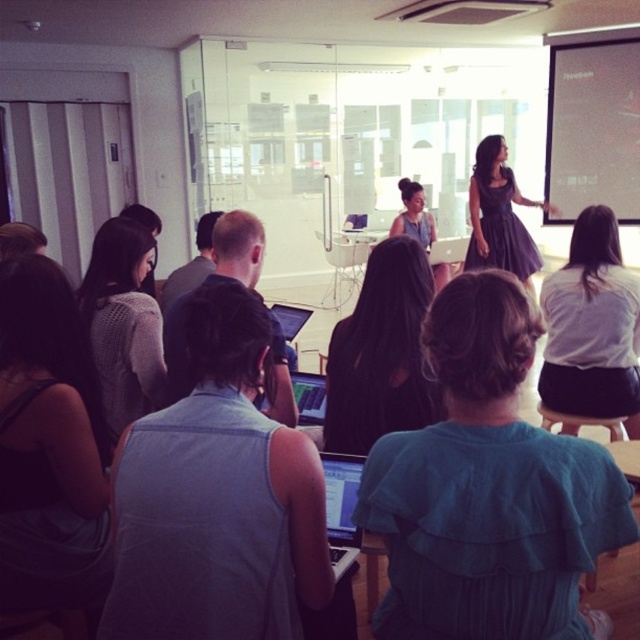
Question: Considering the real-world distances, which object is farthest from the gray fabric shirt at center?

Choices:
 (A) knitted gray sweater at left
 (B) white matte shirt at upper right
 (C) dark purple dress at upper right

Answer: (C)

Question: Can you confirm if matte black laptop at center is positioned to the right of matte black keyboard at center?

Choices:
 (A) yes
 (B) no

Answer: (A)

Question: Can you confirm if gray fabric shirt at center is positioned to the right of black fabric dress at center?

Choices:
 (A) yes
 (B) no

Answer: (B)

Question: Which point appears closest to the camera in this image?

Choices:
 (A) (403, 403)
 (B) (627, 120)

Answer: (A)

Question: Does gray fabric shirt at center appear on the left side of white matte projection screen at upper right?

Choices:
 (A) no
 (B) yes

Answer: (B)

Question: Which object appears farthest from the camera in this image?

Choices:
 (A) matte gray dress at center
 (B) matte black keyboard at center
 (C) white matte projection screen at upper right
 (D) white matte shirt at upper right

Answer: (C)